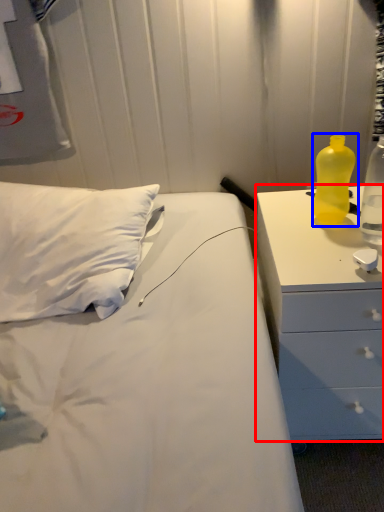
Question: Which object appears farthest to the camera in this image, chest of drawers (highlighted by a red box) or bottle (highlighted by a blue box)?

Choices:
 (A) chest of drawers
 (B) bottle

Answer: (B)